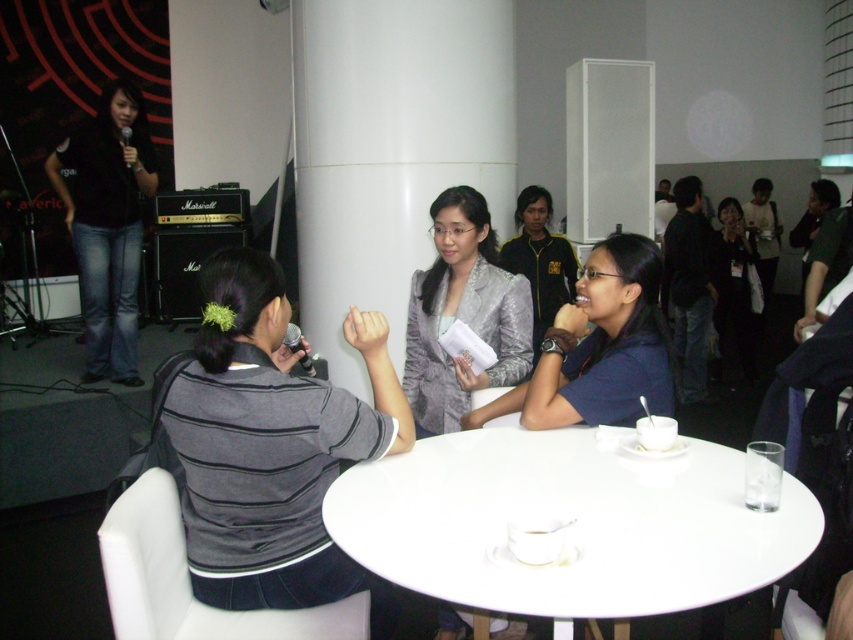
Question: Considering the relative positions of white glossy table at center and blue fabric shirt at center in the image provided, where is white glossy table at center located with respect to blue fabric shirt at center?

Choices:
 (A) above
 (B) below

Answer: (B)

Question: Is gray striped shirt at left thinner than black fabric shirt at center?

Choices:
 (A) no
 (B) yes

Answer: (B)

Question: Is blue fabric shirt at center to the left of black denim jeans at left from the viewer's perspective?

Choices:
 (A) no
 (B) yes

Answer: (A)

Question: Which of the following is the closest to the observer?

Choices:
 (A) pyautogui.click(x=128, y=132)
 (B) pyautogui.click(x=688, y=538)
 (C) pyautogui.click(x=223, y=330)
 (D) pyautogui.click(x=735, y=273)

Answer: (B)

Question: Which is nearer to the white glossy table at center?

Choices:
 (A) silver metallic blazer at center
 (B) black denim jeans at left
 (C) black fabric shirt at center

Answer: (A)

Question: Considering the real-world distances, which object is farthest from the silver metallic blazer at center?

Choices:
 (A) blue fabric shirt at center
 (B) white glossy table at center

Answer: (B)